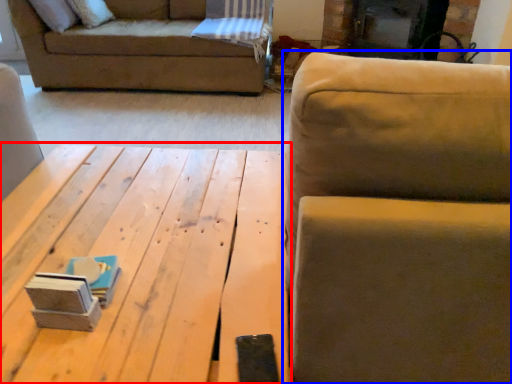
Question: Which of the following is the closest to the observer, table (highlighted by a red box) or studio couch (highlighted by a blue box)?

Choices:
 (A) table
 (B) studio couch

Answer: (B)